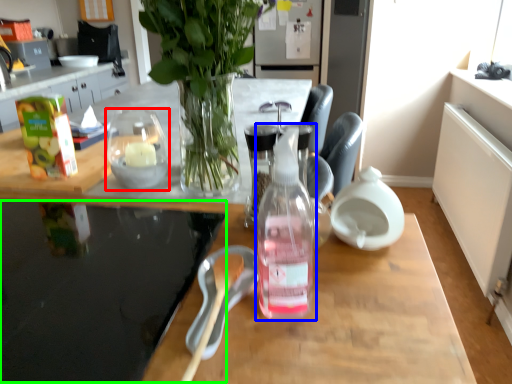
Question: Which is nearer to the tableware (highlighted by a red box)? bottle (highlighted by a blue box) or glass table (highlighted by a green box).

Choices:
 (A) bottle
 (B) glass table

Answer: (B)